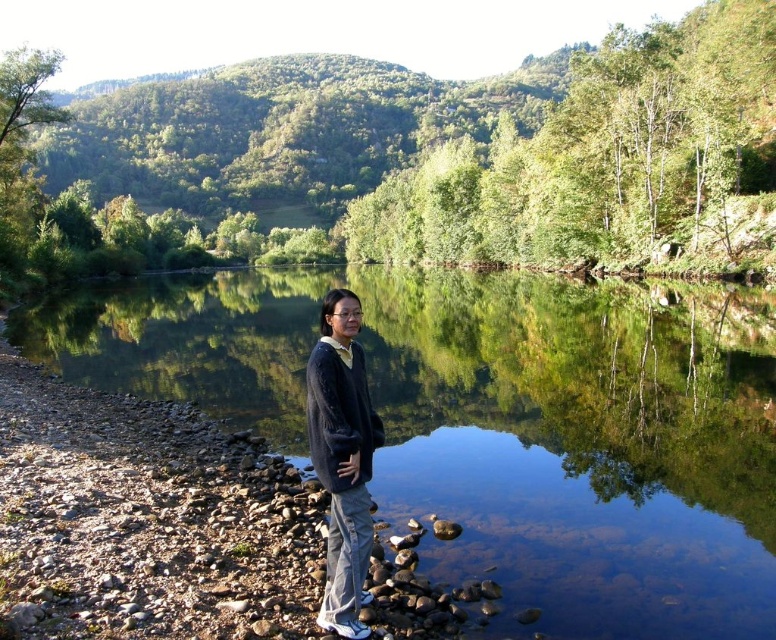
You are an artist trying to paint the scene. You notice the clear glass water at center and the dark blue sweater at center. Which object should you paint first if you want to follow the rule of painting larger objects before smaller ones?

You should paint the clear glass water at center first because it is larger in size than the dark blue sweater at center according to the description.

You are a photographer aiming to capture the reflection of the dark blue sweater at center in the clear glass water at center. Based on the scene, is this possible?

The clear glass water at center is above the dark blue sweater at center, so the sweater is positioned higher than the water. Since reflections require the object to be above the reflective surface, the sweater cannot be reflected in the water because it is already above the water surface.